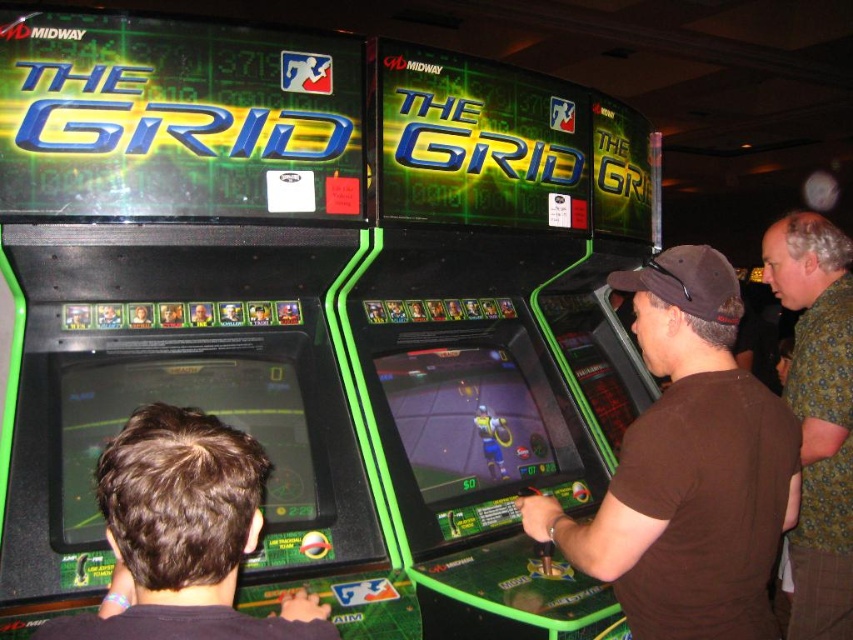
Can you confirm if brown matte hair at lower left is smaller than green floral shirt at upper right?

Yes.

Is point (138, 531) in front of point (846, 440)?

Yes, it is.

Where is `brown matte hair at lower left`? Image resolution: width=853 pixels, height=640 pixels. brown matte hair at lower left is located at coordinates (183, 536).

Can you confirm if brown cotton t-shirt at center is smaller than brown matte hair at lower left?

Actually, brown cotton t-shirt at center might be larger than brown matte hair at lower left.

Where is `brown cotton t-shirt at center`? brown cotton t-shirt at center is located at coordinates coord(689,468).

Who is more forward, (763, 470) or (167, 564)?

Point (167, 564)

Locate an element on the screen. Image resolution: width=853 pixels, height=640 pixels. brown cotton t-shirt at center is located at coordinates (689, 468).

Which is in front, point (660, 579) or point (819, 529)?

Point (660, 579) is more forward.

Is brown cotton t-shirt at center closer to the viewer compared to green floral shirt at upper right?

Yes, it is in front of green floral shirt at upper right.

The image size is (853, 640). What are the coordinates of `brown cotton t-shirt at center` in the screenshot? It's located at (689, 468).